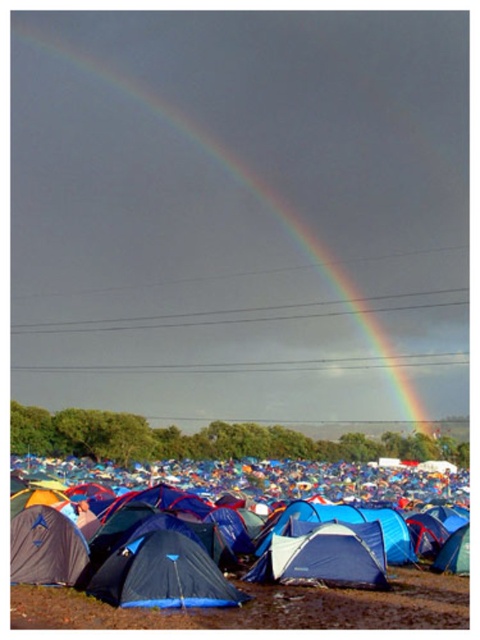
Who is more forward, [97,472] or [110,579]?

Point [110,579]

Does blue fabric tent at lower center have a greater height compared to blue fabric tent at center?

Indeed, blue fabric tent at lower center has a greater height compared to blue fabric tent at center.

Does point (117, 502) come farther from viewer compared to point (240, 600)?

That is True.

Where is `blue fabric tent at lower center`? blue fabric tent at lower center is located at coordinates (292, 492).

Who is more distant from viewer, (x=105, y=397) or (x=142, y=468)?

Point (x=105, y=397)

Find the location of a particular element. rainbow at upper center is located at coordinates (207, 208).

Which is behind, point (29, 202) or point (201, 563)?

Point (29, 202)

Which is more to the left, rainbow at upper center or blue fabric tent at center?

rainbow at upper center

Find the location of a particular element. rainbow at upper center is located at coordinates (207, 208).

The height and width of the screenshot is (640, 480). Find the location of `rainbow at upper center`. rainbow at upper center is located at coordinates (207, 208).